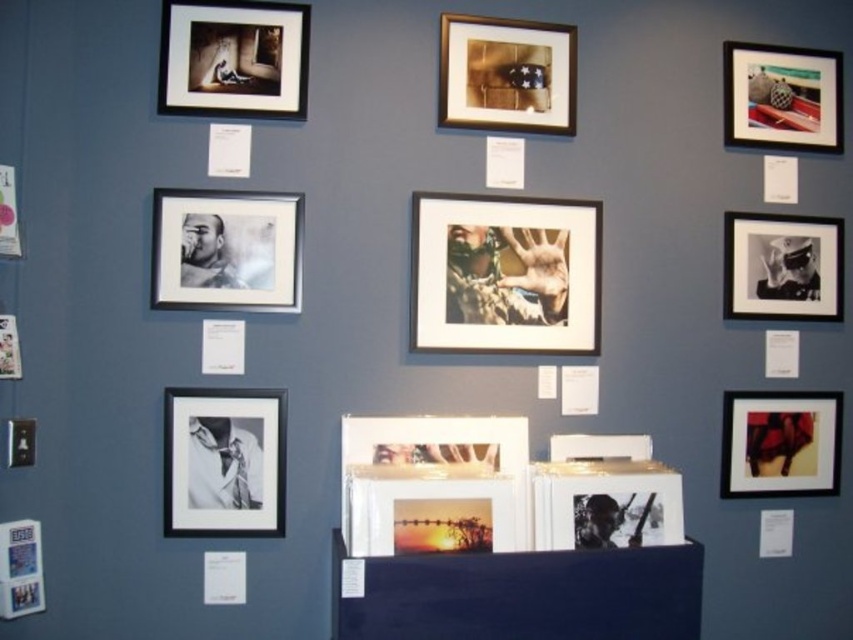
You are an interior designer arranging two frames on a wall. You have a black matte photo frame at lower left and a matte black picture frame at lower left. Which frame is wider?

The black matte photo frame at lower left is wider than the matte black picture frame at lower left.

You are an interior designer arranging a wall display. You have two frames, the black matte photo frame at lower left and the matte black picture frame at lower left. The wall has a minimum spacing requirement of 50 centimeters between frames. Based on their current positions, can you place them side by side without violating the spacing rule?

The black matte photo frame at lower left is 47.30 centimeters from matte black picture frame at lower left. Since the required spacing is 50 centimeters and the current distance is less than that, placing them side by side would violate the spacing rule.

You are an interior designer arranging a wall display. You have two items to place on the right side of the wall. One is the black matte photo frame at right and the other is the black glossy photograph at right. According to the existing arrangement, which item should be placed to the left to maintain the layout?

The black matte photo frame at right should be placed to the left of the black glossy photograph at right to maintain the layout.